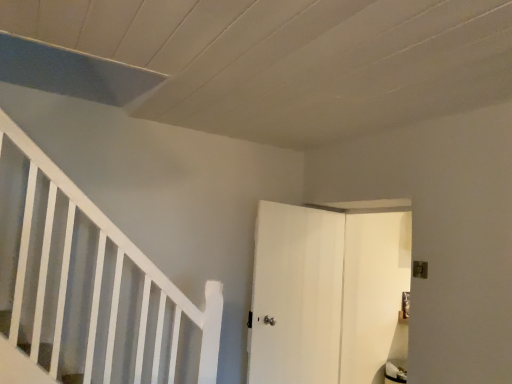
Question: Considering the relative sizes of white matte door at center, which ranks as the 1th door in left-to-right order, and smooth gray stair at lower left in the image provided, is white matte door at center, which ranks as the 1th door in left-to-right order, shorter than smooth gray stair at lower left?

Choices:
 (A) no
 (B) yes

Answer: (A)

Question: Does white matte door at center, which ranks as the 1th door in left-to-right order, have a larger size compared to smooth gray stair at lower left?

Choices:
 (A) yes
 (B) no

Answer: (A)

Question: From the image's perspective, does white matte door at center, which ranks as the 1th door in left-to-right order, appear lower than smooth gray stair at lower left?

Choices:
 (A) no
 (B) yes

Answer: (B)

Question: Is white matte door at center, which ranks as the 1th door in left-to-right order, to the right of smooth gray stair at lower left from the viewer's perspective?

Choices:
 (A) no
 (B) yes

Answer: (B)

Question: From the image's perspective, would you say white matte door at center, which ranks as the 1th door in left-to-right order, is positioned over smooth gray stair at lower left?

Choices:
 (A) no
 (B) yes

Answer: (A)

Question: Based on their sizes in the image, would you say white matte door at center, which ranks as the 1th door in left-to-right order, is bigger or smaller than white matte door at center, the first door when ordered from right to left?

Choices:
 (A) big
 (B) small

Answer: (B)

Question: From their relative heights in the image, would you say white matte door at center, which is counted as the second door, starting from the right, is taller or shorter than white matte door at center, positioned as the 2th door in left-to-right order?

Choices:
 (A) tall
 (B) short

Answer: (B)

Question: From a real-world perspective, is white matte door at center, which ranks as the 1th door in left-to-right order, positioned above or below white matte door at center, positioned as the 2th door in left-to-right order?

Choices:
 (A) above
 (B) below

Answer: (B)

Question: From the image's perspective, is white matte door at center, which is counted as the second door, starting from the right, above or below white matte door at center, the first door when ordered from right to left?

Choices:
 (A) above
 (B) below

Answer: (A)

Question: Is white matte door at center, which ranks as the 1th door in left-to-right order, bigger or smaller than smooth gray stair at lower left?

Choices:
 (A) big
 (B) small

Answer: (A)

Question: Does point (279, 317) appear closer or farther from the camera than point (28, 350)?

Choices:
 (A) farther
 (B) closer

Answer: (A)

Question: Considering the relative positions of white matte door at center, which is counted as the second door, starting from the right, and smooth gray stair at lower left in the image provided, is white matte door at center, which is counted as the second door, starting from the right, to the left or to the right of smooth gray stair at lower left?

Choices:
 (A) right
 (B) left

Answer: (A)

Question: Looking at their shapes, would you say white matte door at center, which ranks as the 1th door in left-to-right order, is wider or thinner than smooth gray stair at lower left?

Choices:
 (A) wide
 (B) thin

Answer: (B)

Question: Is smooth gray stair at lower left situated inside white matte door at center, positioned as the 2th door in left-to-right order, or outside?

Choices:
 (A) inside
 (B) outside

Answer: (B)

Question: Considering their positions, is smooth gray stair at lower left located in front of or behind white matte door at center, the first door when ordered from right to left?

Choices:
 (A) front
 (B) behind

Answer: (A)